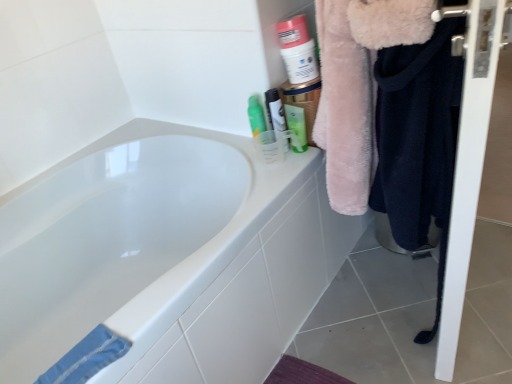
You are a GUI agent. You are given a task and a screenshot of the screen. Output one action in this format:
    pyautogui.click(x=<x>, y=<y>)
    Task: Click on the free space underneath fuzzy pink coat at right (from a real-world perspective)
    
    Given the screenshot: What is the action you would take?
    pyautogui.click(x=380, y=310)